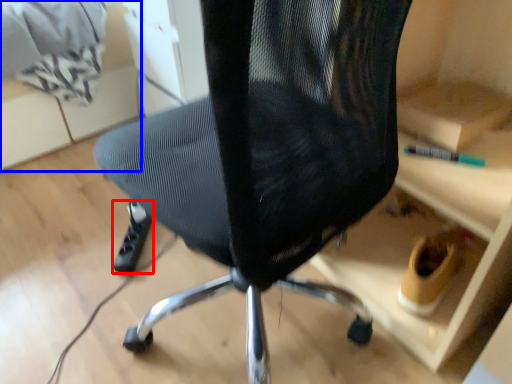
Question: Which object is closer to the camera taking this photo, foot (highlighted by a red box) or shelf (highlighted by a blue box)?

Choices:
 (A) foot
 (B) shelf

Answer: (A)